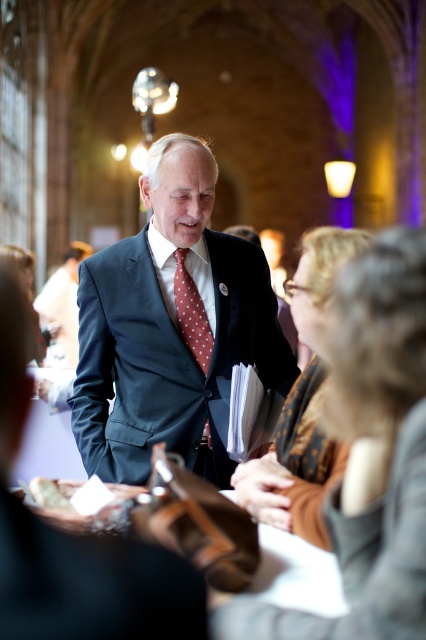
Question: Is brown textured scarf at center wider than polka dot silk tie at center?

Choices:
 (A) no
 (B) yes

Answer: (B)

Question: Based on their relative distances, which object is farther from the matte blue suit at center?

Choices:
 (A) polka dot silk tie at center
 (B) brown textured scarf at center

Answer: (B)

Question: Can you confirm if matte blue suit at center is positioned to the right of brown textured scarf at center?

Choices:
 (A) yes
 (B) no

Answer: (B)

Question: Does matte blue suit at center have a smaller size compared to polka dot silk tie at center?

Choices:
 (A) yes
 (B) no

Answer: (B)

Question: Which point is closer to the camera?

Choices:
 (A) (204, 358)
 (B) (108, 296)
 (C) (307, 234)

Answer: (A)

Question: Which point is farther from the camera taking this photo?

Choices:
 (A) (296, 285)
 (B) (198, 321)
 (C) (204, 323)

Answer: (B)